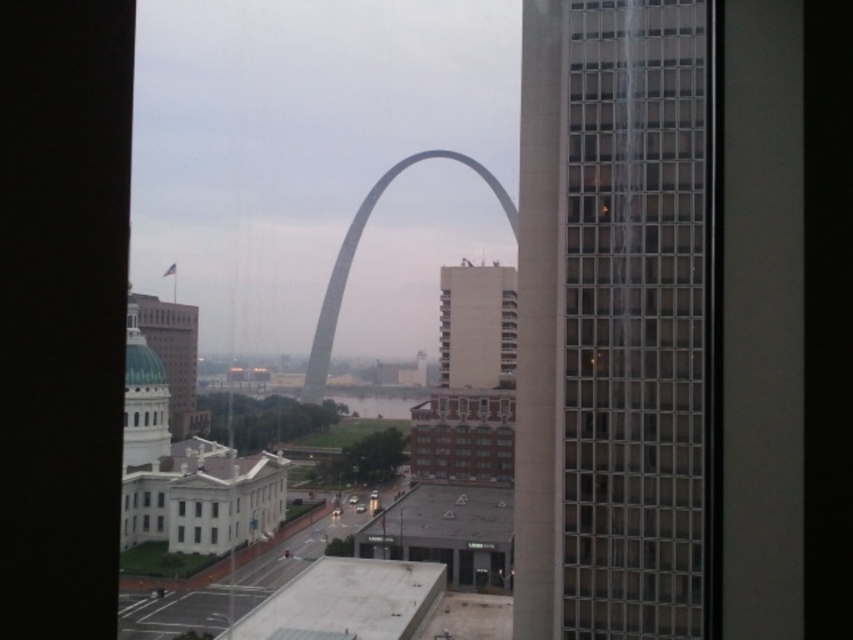
Is white concrete building at center smaller than transparent glass building at center?

No.

Can you confirm if white concrete building at center is positioned above transparent glass building at center?

Yes, white concrete building at center is above transparent glass building at center.

Describe the element at coordinates (477, 324) in the screenshot. I see `white concrete building at center` at that location.

The height and width of the screenshot is (640, 853). I want to click on white concrete building at center, so click(477, 324).

Which of these two, gray metallic arch at center or green dome building at left, stands shorter?

Standing shorter between the two is green dome building at left.

Is gray metallic arch at center below green dome building at left?

No.

Is point (338, 284) closer to camera compared to point (152, 298)?

No, it is not.

Where is `gray metallic arch at center`? This screenshot has width=853, height=640. gray metallic arch at center is located at coordinates (354, 252).

Identify the location of green dome building at left. (173, 358).

Based on the photo, is green dome building at left thinner than clear glass windows at center?

No.

Where is `green dome building at left`? green dome building at left is located at coordinates (173, 358).

Identify the location of green dome building at left. The width and height of the screenshot is (853, 640). [173, 358].